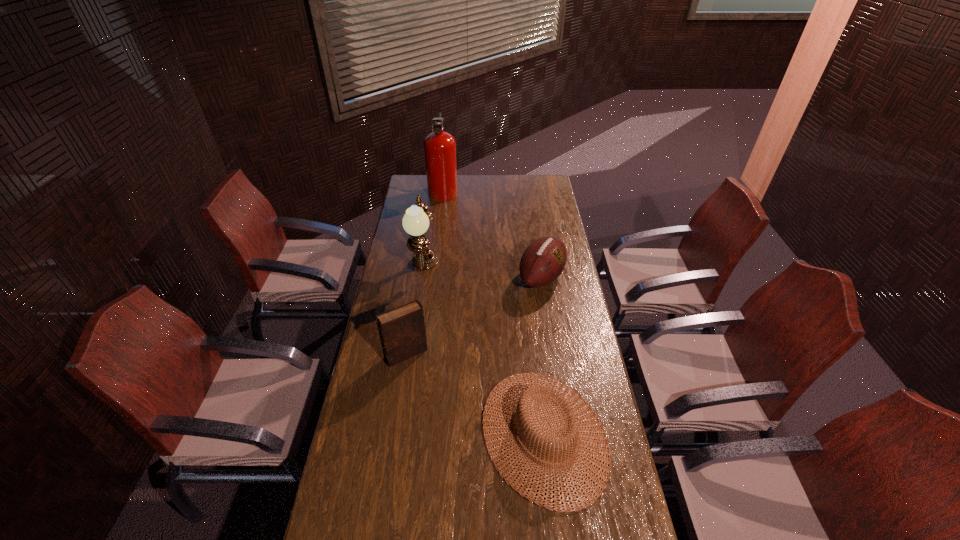
The image size is (960, 540). I want to click on the tallest object, so click(x=439, y=146).

The width and height of the screenshot is (960, 540). I want to click on the farthest object, so click(439, 146).

Identify the location of oil lamp. Image resolution: width=960 pixels, height=540 pixels. (415, 222).

This screenshot has width=960, height=540. Find the location of `Bible`. Bible is located at coordinates (402, 331).

This screenshot has width=960, height=540. I want to click on the second nearest object, so click(x=402, y=331).

Where is `football (American)`? Image resolution: width=960 pixels, height=540 pixels. football (American) is located at coordinates (543, 261).

At what (x,y) coordinates should I click in order to perform the action: click on sunhat. Please return your answer as a coordinate pair (x, y). Looking at the image, I should click on (531, 392).

This screenshot has width=960, height=540. I want to click on the nearest object, so click(531, 392).

Locate an element on the screen. free region located with the handle and nozzle on the tallest object is located at coordinates (488, 191).

Locate an element on the screen. The height and width of the screenshot is (540, 960). vacant area situated on the left of the oil lamp is located at coordinates (391, 271).